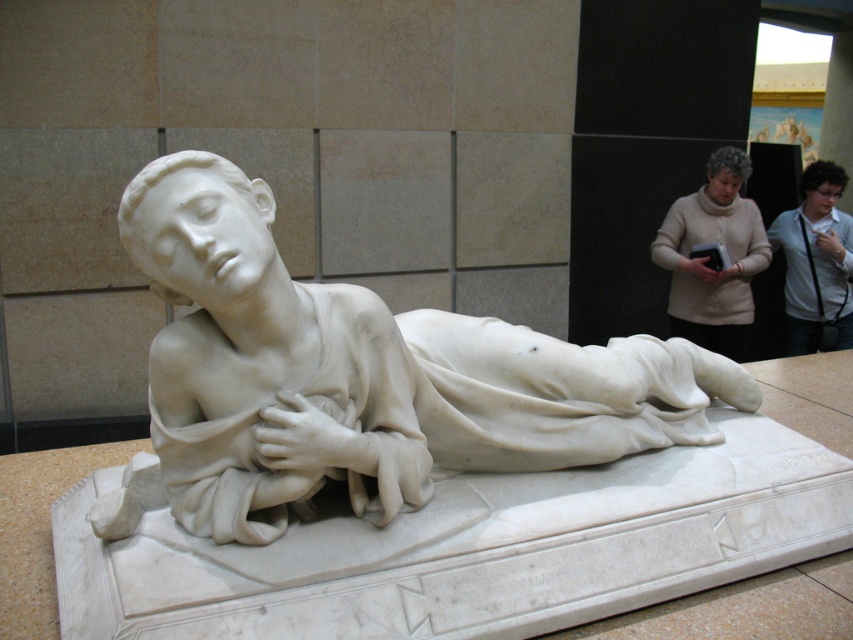
Question: Is white marble statue at center further to camera compared to white shirt at upper right?

Choices:
 (A) yes
 (B) no

Answer: (B)

Question: Which point is closer to the camera?

Choices:
 (A) (810, 300)
 (B) (672, 320)

Answer: (B)

Question: Is white marble statue at center below beige sweater at upper right?

Choices:
 (A) no
 (B) yes

Answer: (B)

Question: Which point is closer to the camera taking this photo?

Choices:
 (A) (801, 310)
 (B) (440, 397)

Answer: (B)

Question: Can you confirm if white marble statue at center is positioned to the left of white shirt at upper right?

Choices:
 (A) no
 (B) yes

Answer: (B)

Question: Which point is closer to the camera?

Choices:
 (A) white marble statue at center
 (B) white shirt at upper right
 (C) beige sweater at upper right

Answer: (A)